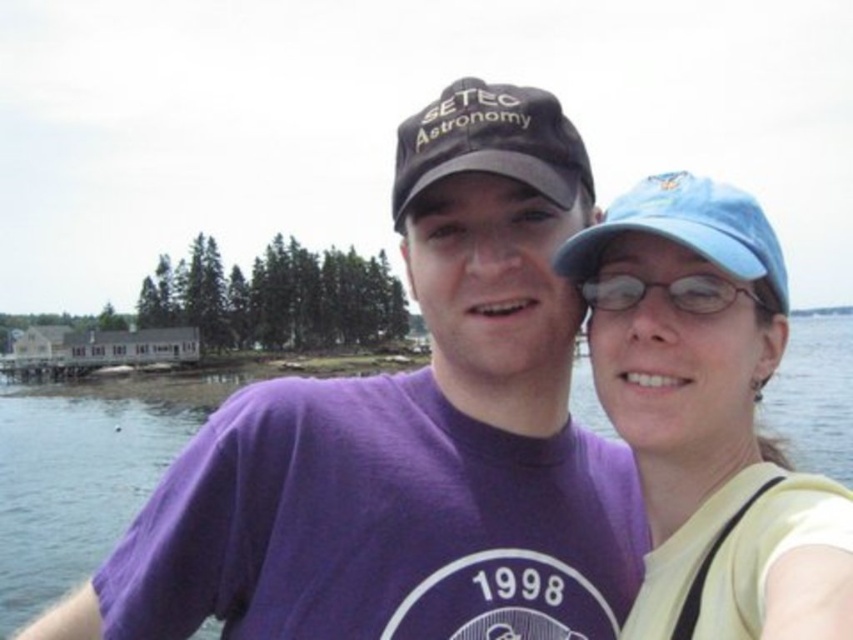
Question: Is transparent water at center smaller than black fabric cap at center?

Choices:
 (A) yes
 (B) no

Answer: (B)

Question: Which is farther from the matte blue cap at upper right?

Choices:
 (A) transparent water at center
 (B) blue fabric baseball cap at right
 (C) purple cotton t-shirt at center
 (D) black fabric cap at center

Answer: (A)

Question: Which object appears farthest from the camera in this image?

Choices:
 (A) purple cotton t-shirt at center
 (B) blue fabric baseball cap at right
 (C) black fabric cap at center

Answer: (C)

Question: Is purple cotton t-shirt at center to the left of clear plastic glasses at upper center from the viewer's perspective?

Choices:
 (A) yes
 (B) no

Answer: (A)

Question: Does blue fabric baseball cap at right appear on the left side of clear plastic glasses at upper center?

Choices:
 (A) yes
 (B) no

Answer: (A)

Question: Based on their relative distances, which object is farther from the matte blue cap at upper right?

Choices:
 (A) transparent water at center
 (B) purple cotton t-shirt at center

Answer: (A)